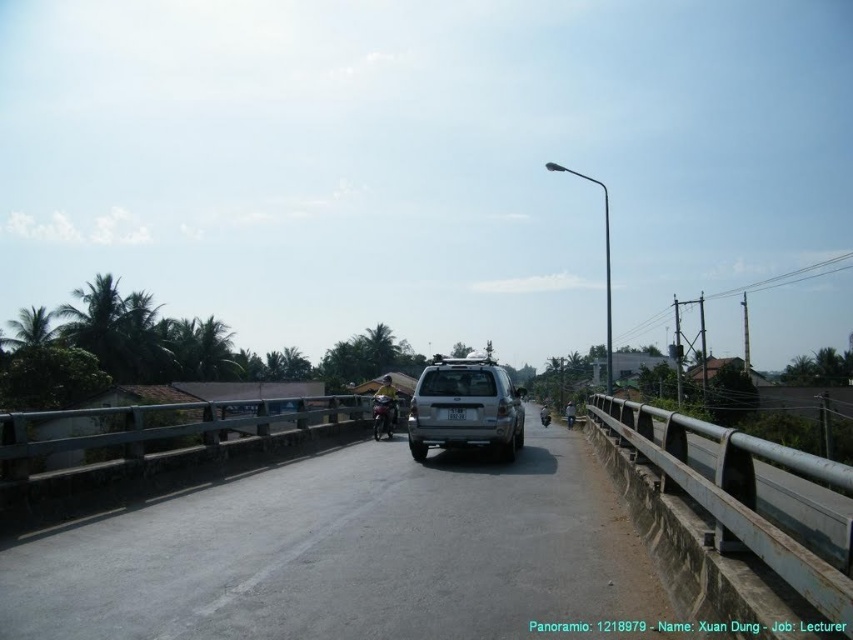
You are driving a car and want to pass the silver metallic suv at center on the right side of the road. The metallic gray rail at right is in your path. Can you safely pass the suv without hitting the rail?

The silver metallic suv at center is closer to you than the metallic gray rail at right. Since the suv is in front of the rail, you can safely pass the suv on the right side of the road without hitting the rail as the rail is further away.

You are standing on the bridge and want to place a small warning sign exactly where the metallic gray rail at center is located. According to the image, what are the coordinates where you should place the sign?

The coordinates for the metallic gray rail at center are at point (x=151, y=433), so you should place the sign there.

You are a delivery driver needing to pass through a narrow section of the bridge. The narrow section is as wide as the metallic gray rail at right. Can your silver metallic suv at center fit through it?

The silver metallic suv at center is wider than the metallic gray rail at right, so it cannot fit through the narrow section that is as wide as the rail.